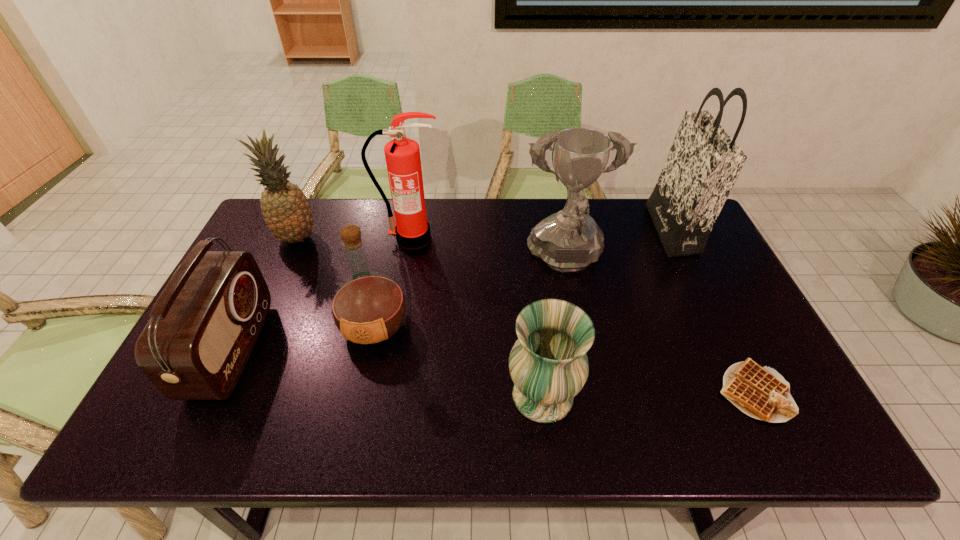
This screenshot has width=960, height=540. I want to click on object present at the near left corner, so click(x=203, y=327).

Identify the location of object located at the far right corner. (704, 162).

Locate an element on the screen. Image resolution: width=960 pixels, height=540 pixels. object at the near right corner is located at coordinates (760, 392).

Where is `vacant space at the far edge of the desktop`? The width and height of the screenshot is (960, 540). vacant space at the far edge of the desktop is located at coordinates (440, 199).

Where is `vacant space at the near edge`? vacant space at the near edge is located at coordinates (571, 433).

The image size is (960, 540). Find the location of `free spot at the right edge of the desktop`. free spot at the right edge of the desktop is located at coordinates [x=738, y=305].

Where is `vacant area at the near right corner`? vacant area at the near right corner is located at coordinates pyautogui.click(x=763, y=444).

Locate an element on the screen. This screenshot has height=540, width=960. vacant area that lies between the vase and the shortest object is located at coordinates (648, 394).

Locate an element on the screen. This screenshot has height=540, width=960. free space between the liquor and the pineapple is located at coordinates (336, 282).

Image resolution: width=960 pixels, height=540 pixels. I want to click on free space between the pineapple and the award, so click(431, 249).